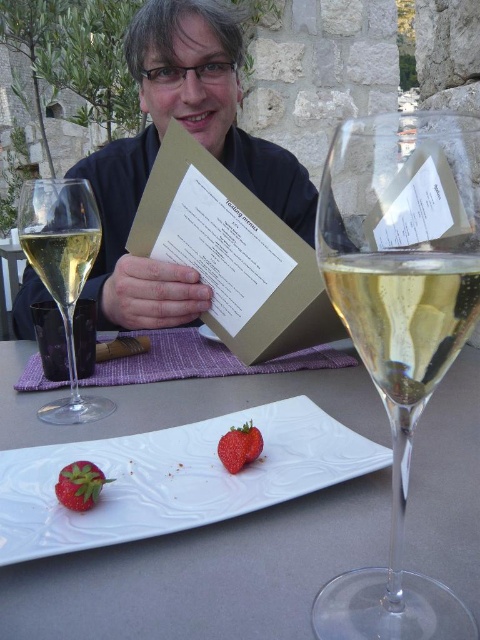
Question: Which of the following is the farthest from the observer?

Choices:
 (A) clear glass wine glass at left
 (B) white glossy plate at center
 (C) red matte strawberry at lower left

Answer: (A)

Question: Which of these objects is positioned farthest from the red matte strawberry at lower left?

Choices:
 (A) white glossy plate at center
 (B) clear glass wine glass at center
 (C) clear glass champagne at left
 (D) matte black card at center

Answer: (D)

Question: Can you confirm if clear glass champagne at right is positioned to the right of red matte strawberry at lower left?

Choices:
 (A) yes
 (B) no

Answer: (A)

Question: Can you confirm if clear glass wine glass at left is wider than red matte strawberry at lower center?

Choices:
 (A) yes
 (B) no

Answer: (A)

Question: Which object is positioned farthest from the clear glass wine glass at left?

Choices:
 (A) white glossy plate at center
 (B) matte black card at center
 (C) clear glass wine glass at center
 (D) clear glass champagne at right

Answer: (B)

Question: Does white glossy plate at center have a smaller size compared to clear glass champagne at left?

Choices:
 (A) yes
 (B) no

Answer: (B)